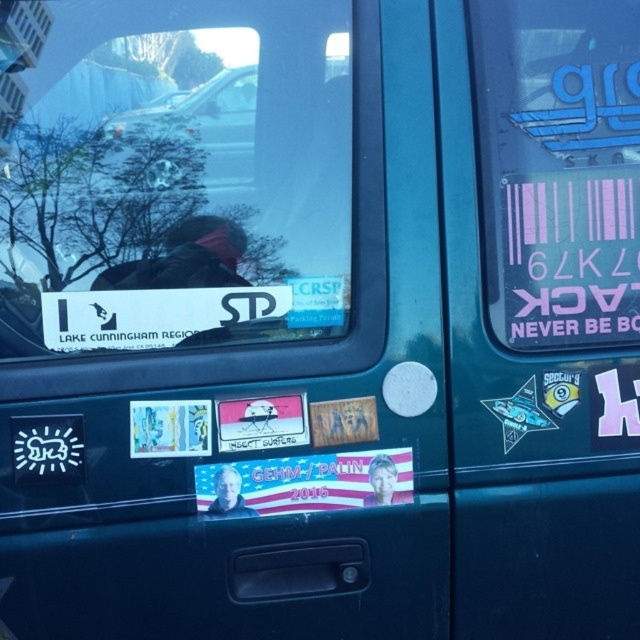
You are a delivery driver who needs to attach a new sticker to your vehicle. You currently have a pink matte sticker at upper right and a metallic silver car at upper center. Where should you place the new sticker so it doesn t overlap with existing ones?

The pink matte sticker at upper right is located below the metallic silver car at upper center, so placing the new sticker above the metallic silver car at upper center or below the pink matte sticker at upper right would avoid overlapping.

You are a delivery driver who just arrived at a client location. You need to locate the pink matte sticker at upper right on the vehicle. Where exactly should you look on the vehicle to find it?

The pink matte sticker at upper right is located at point (560, 168) on the vehicle.